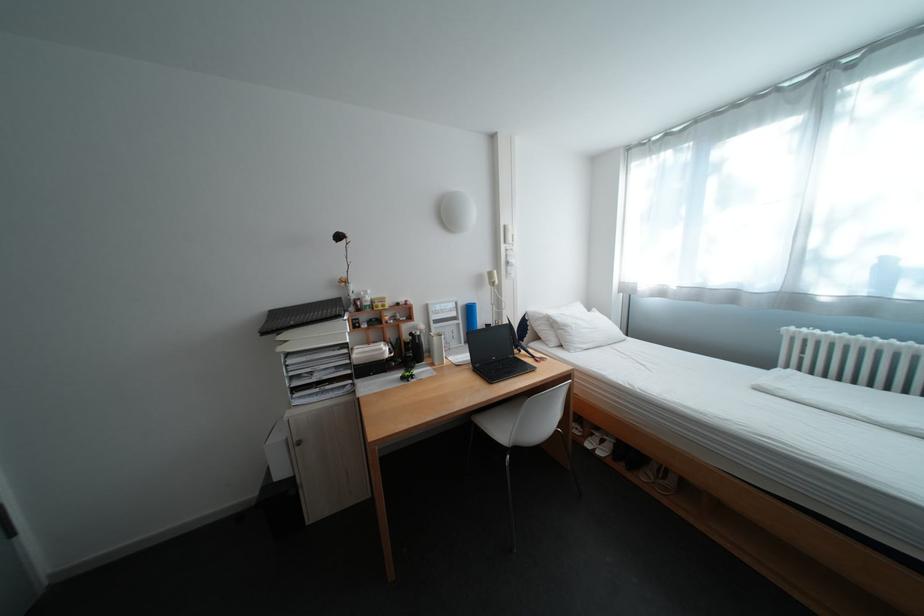
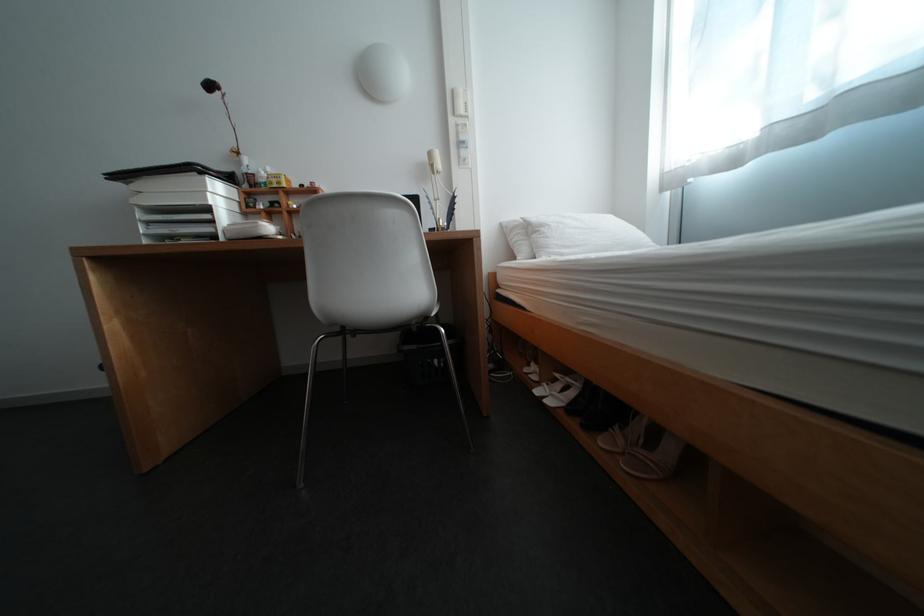
Locate, in the second image, the point that corresponds to (x=666, y=484) in the first image.

(637, 455)